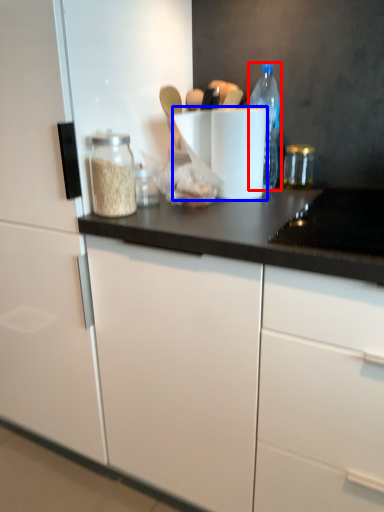
Question: Which object is further to the camera taking this photo, bottle (highlighted by a red box) or paper towel (highlighted by a blue box)?

Choices:
 (A) bottle
 (B) paper towel

Answer: (A)